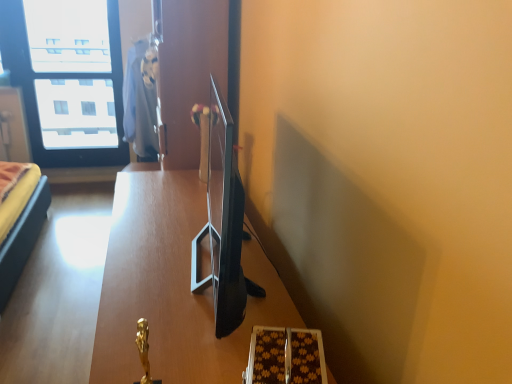
Question: Should I look upward or downward to see transparent glass window at upper left?

Choices:
 (A) down
 (B) up

Answer: (B)

Question: Are wooden table at center and transparent glass window at upper left located far from each other?

Choices:
 (A) no
 (B) yes

Answer: (B)

Question: Can you confirm if wooden table at center is shorter than transparent glass window at upper left?

Choices:
 (A) yes
 (B) no

Answer: (A)

Question: From a real-world perspective, is wooden table at center physically below transparent glass window at upper left?

Choices:
 (A) yes
 (B) no

Answer: (A)

Question: Does wooden table at center have a larger size compared to transparent glass window at upper left?

Choices:
 (A) no
 (B) yes

Answer: (B)

Question: From the image's perspective, is wooden table at center below transparent glass window at upper left?

Choices:
 (A) yes
 (B) no

Answer: (A)

Question: Considering the relative sizes of wooden table at center and transparent glass window at upper left in the image provided, is wooden table at center taller than transparent glass window at upper left?

Choices:
 (A) no
 (B) yes

Answer: (A)

Question: From a real-world perspective, is wooden table at center below matte blue robe at upper center?

Choices:
 (A) no
 (B) yes

Answer: (B)

Question: Is wooden table at center not within matte blue robe at upper center?

Choices:
 (A) yes
 (B) no

Answer: (A)

Question: From the image's perspective, is wooden table at center under matte blue robe at upper center?

Choices:
 (A) yes
 (B) no

Answer: (A)

Question: Does wooden table at center come in front of matte blue robe at upper center?

Choices:
 (A) no
 (B) yes

Answer: (B)

Question: Is wooden table at center aimed at matte blue robe at upper center?

Choices:
 (A) no
 (B) yes

Answer: (A)

Question: Does wooden table at center have a smaller size compared to matte blue robe at upper center?

Choices:
 (A) yes
 (B) no

Answer: (B)

Question: Is transparent glass window at upper left at the back of matte blue robe at upper center?

Choices:
 (A) no
 (B) yes

Answer: (A)